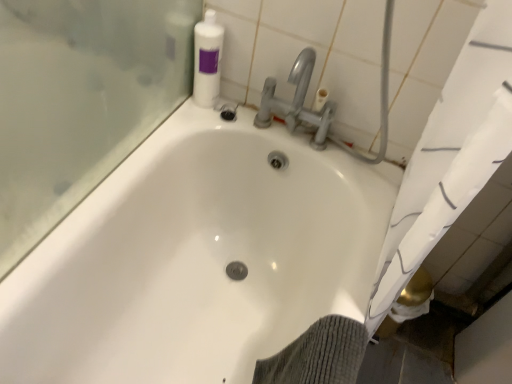
The width and height of the screenshot is (512, 384). Find the location of `spots to the right of white plastic bottle at upper right`. spots to the right of white plastic bottle at upper right is located at coordinates (247, 113).